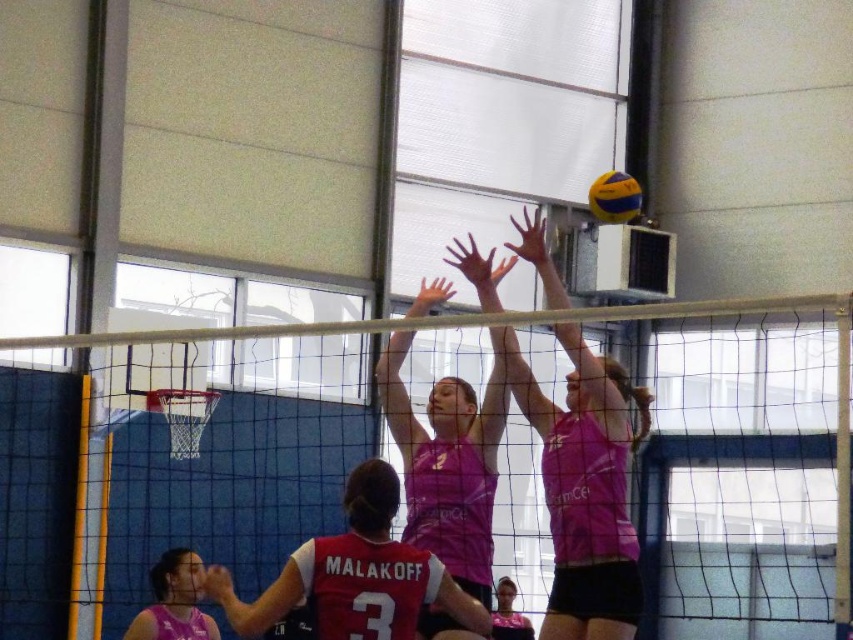
Question: Estimate the real-world distances between objects in this image. Which object is farther from the pink fabric shirt at upper center?

Choices:
 (A) pink jersey at center
 (B) white mesh net at center
 (C) pink fabric jersey at center
 (D) yellow and blue textured volleyball at upper center

Answer: (D)

Question: Does pink fabric shirt at upper center appear under pink jersey at center?

Choices:
 (A) no
 (B) yes

Answer: (B)

Question: Can you confirm if pink jersey at center is smaller than pink fabric jersey at center?

Choices:
 (A) yes
 (B) no

Answer: (B)

Question: Which point is closer to the camera?

Choices:
 (A) pink jersey at center
 (B) white mesh net at center
 (C) pink fabric shirt at upper center

Answer: (B)

Question: Does pink fabric shirt at upper center appear under pink jersey at center?

Choices:
 (A) yes
 (B) no

Answer: (A)

Question: Which is nearer to the pink fabric jersey at center?

Choices:
 (A) white mesh net at center
 (B) yellow and blue textured volleyball at upper center
 (C) pink fabric shirt at upper center

Answer: (C)